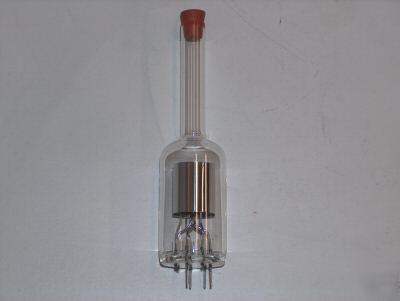
You are a GUI agent. You are given a task and a screenshot of the screen. Output one action in this format:
    pyautogui.click(x=<x>, y=<y>)
    Task: Click on the white surface
    Image resolution: width=400 pixels, height=301 pixels.
    Given the screenshot: What is the action you would take?
    pyautogui.click(x=78, y=90)